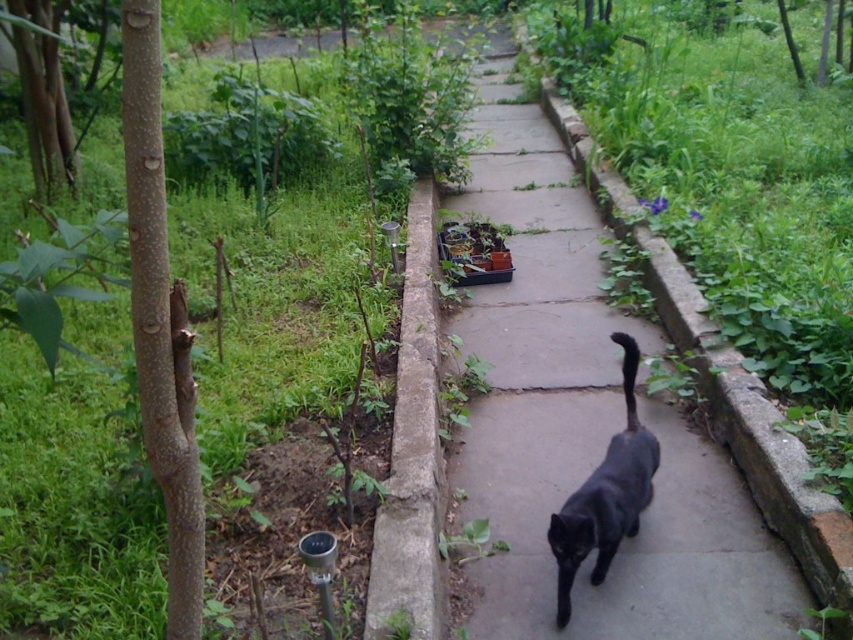
You are standing on the grassy area next to the concrete pathway in the garden. You want to walk to the point marked as point (x=587, y=426). Is the point on the concrete pathway or on the grass?

The point (x=587, y=426) is on the concrete at center, so it is on the concrete pathway.

You are a gardener who wants to place a new potted plant on the concrete at center without disturbing the black matte cat at center. Is this possible?

The concrete at center is positioned over the black matte cat at center, so placing a potted plant on the concrete at center would disturb the cat. Choose another location.

You are a gardener who needs to water the green leafy plant at upper left and the concrete at center. Which one should you water first if you want to avoid getting the concrete wet?

You should water the concrete at center first because the green leafy plant at upper left is above it, so watering the plant afterward might drip onto the concrete.